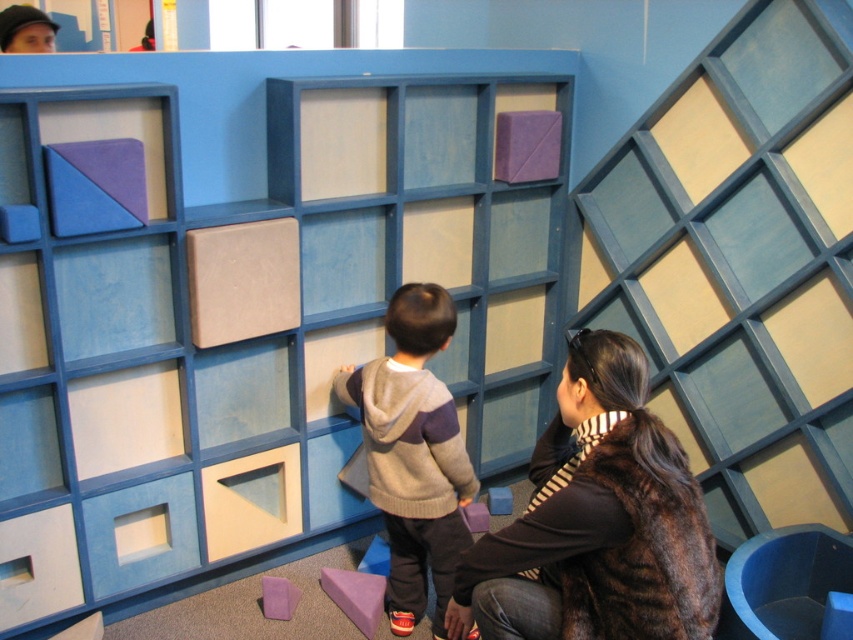
Question: Can you confirm if knit sweater at center is positioned to the right of purple foam triangle at lower center?

Choices:
 (A) no
 (B) yes

Answer: (B)

Question: Can you confirm if purple foam triangle at lower center is smaller than purple matte cube at lower center?

Choices:
 (A) yes
 (B) no

Answer: (B)

Question: Which point is closer to the camera?

Choices:
 (A) (363, 573)
 (B) (445, 566)
 (C) (512, 497)

Answer: (B)

Question: Can you confirm if brown fur coat at center is bigger than purple foam triangle at lower center?

Choices:
 (A) no
 (B) yes

Answer: (B)

Question: Which is nearer to the purple matte cube at lower center?

Choices:
 (A) purple matte cube at center
 (B) purple matte triangle at upper center
 (C) purple foam triangle at lower center

Answer: (C)

Question: Which object is the farthest from the purple matte cube at center?

Choices:
 (A) purple foam triangle at lower center
 (B) brown fur coat at center
 (C) knit sweater at center

Answer: (B)